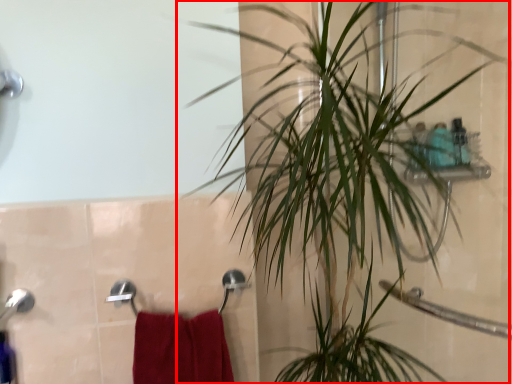
Question: In this image, where is houseplant (annotated by the red box) located relative to bath towel?

Choices:
 (A) right
 (B) left

Answer: (A)